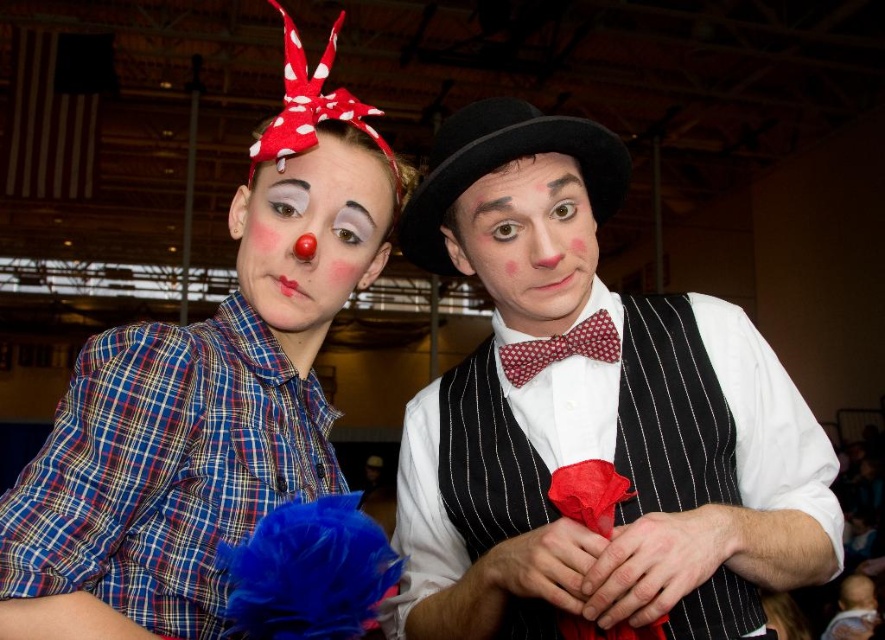
Question: Estimate the real-world distances between objects in this image. Which object is farther from the matte clown nose at center?

Choices:
 (A) matte black vest at center
 (B) red dotted bow tie at center
 (C) matte red bow tie at center

Answer: (A)

Question: Does matte black vest at center have a greater width compared to matte red bow tie at center?

Choices:
 (A) yes
 (B) no

Answer: (A)

Question: Can you confirm if matte black vest at center is positioned to the right of matte clown nose at center?

Choices:
 (A) no
 (B) yes

Answer: (B)

Question: Which of the following is the closest to the observer?

Choices:
 (A) matte red bow tie at center
 (B) red dotted bow tie at center
 (C) matte black vest at center

Answer: (C)

Question: Estimate the real-world distances between objects in this image. Which object is farther from the matte black vest at center?

Choices:
 (A) matte clown nose at center
 (B) red dotted bow tie at center
 (C) matte red bow tie at center

Answer: (A)

Question: Is matte black vest at center to the left of red dotted bow tie at center from the viewer's perspective?

Choices:
 (A) no
 (B) yes

Answer: (B)